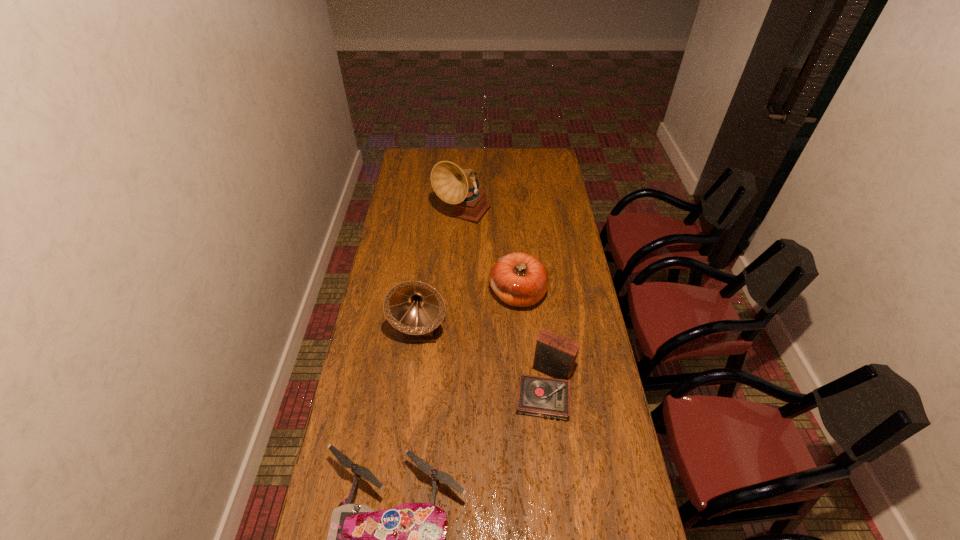
At what (x,y) coordinates should I click in order to perform the action: click on object identified as the closest to the shortest object. Please return your answer as a coordinate pair (x, y). The height and width of the screenshot is (540, 960). Looking at the image, I should click on (555, 355).

Identify the location of object that ranks as the second closest to the pumpkin. The width and height of the screenshot is (960, 540). (555, 355).

Locate which phonograph record is the second closest to the pumpkin. Please provide its 2D coordinates. Your answer should be formatted as a tuple, i.e. [(x, y)], where the tuple contains the x and y coordinates of a point satisfying the conditions above.

[(555, 355)]

Identify which phonograph record is the second closest to the drone. Please provide its 2D coordinates. Your answer should be formatted as a tuple, i.e. [(x, y)], where the tuple contains the x and y coordinates of a point satisfying the conditions above.

[(415, 308)]

Locate an element on the screen. The width and height of the screenshot is (960, 540). vacant space that satisfies the following two spatial constraints: 1. on the horn of the pumpkin; 2. on the left side of the tallest object is located at coordinates (460, 293).

Locate an element on the screen. This screenshot has height=540, width=960. free location that satisfies the following two spatial constraints: 1. on the horn of the shortest phonograph record; 2. on the right side of the second nearest phonograph record is located at coordinates (414, 388).

You are a GUI agent. You are given a task and a screenshot of the screen. Output one action in this format:
    pyautogui.click(x=<x>, y=<y>)
    Task: Click on the vacant region that satisfies the following two spatial constraints: 1. on the horn of the farthest object; 2. on the right side of the pumpkin
    
    Given the screenshot: What is the action you would take?
    pyautogui.click(x=460, y=293)

The image size is (960, 540). Identify the location of vacant space that satisfies the following two spatial constraints: 1. on the horn of the farthest object; 2. on the left side of the pumpkin. (460, 293).